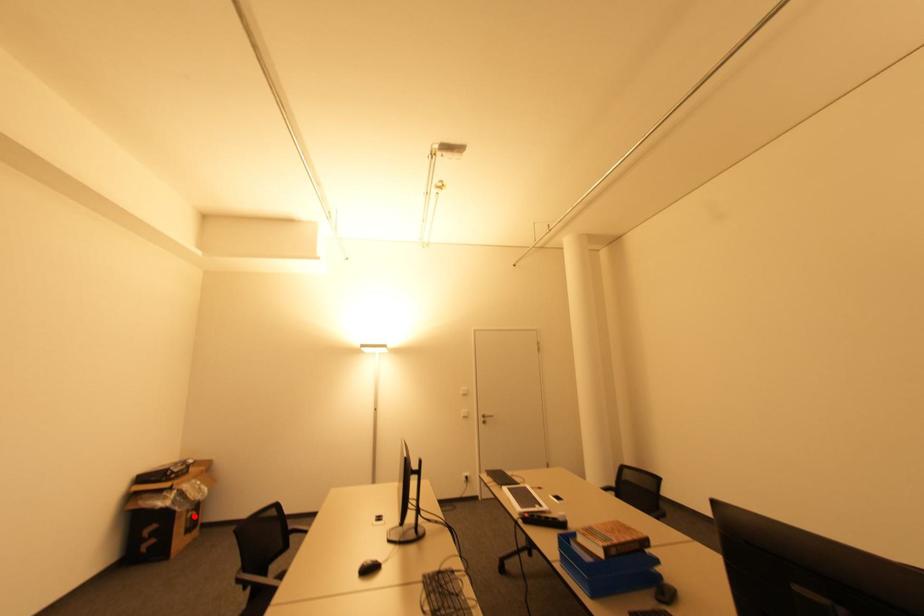
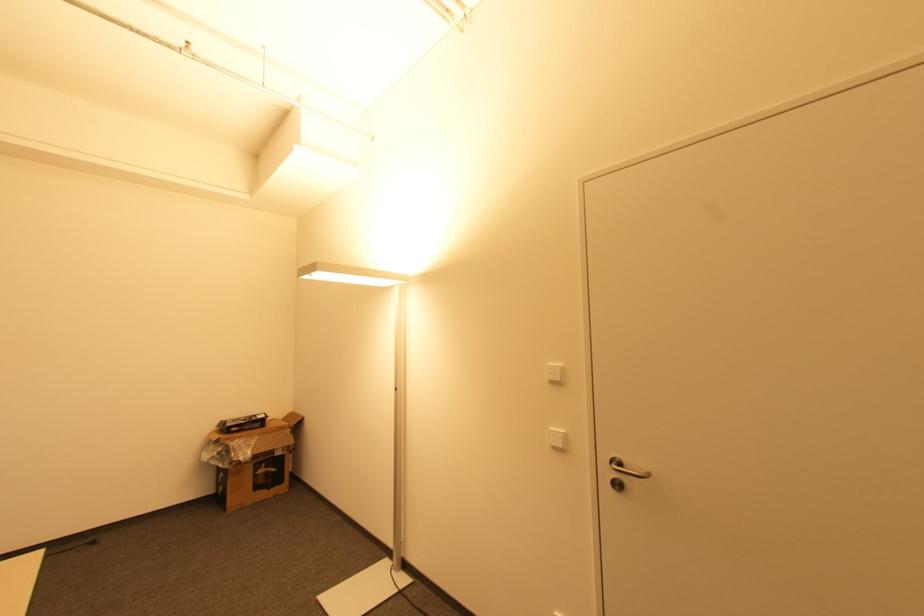
Question: A red point is marked in image1. In image2, is the corresponding 3D point closer to the camera or farther? Reply with the corresponding letter.

Choices:
 (A) The corresponding 3D point is closer.
 (B) The corresponding 3D point is farther.

Answer: (B)